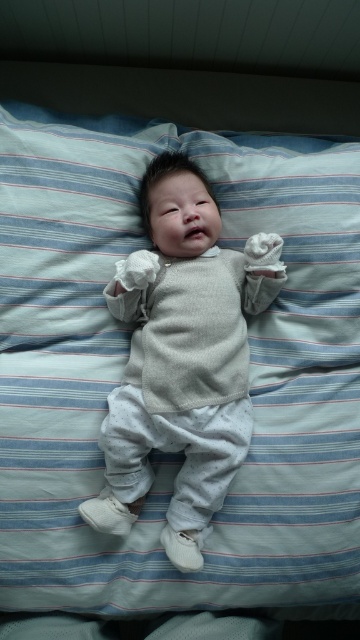
You are a photographer trying to capture a closeup of the light blue striped pillow at center. You are currently standing 3.39 feet away from the pillow. Is the distance sufficient for a clear closeup shot?

The light blue striped pillow at center and camera are 3.39 feet apart, so the distance is sufficient for a clear closeup shot.

You are a photographer setting up a shoot in the room. You need to place a small prop between the light blue striped pillow at center and the light gray knit sweater at center. Based on their positions, which side of the sweater should you place the prop?

The light blue striped pillow at center is on the left side of the light gray knit sweater at center, so you should place the prop to the left of the sweater.